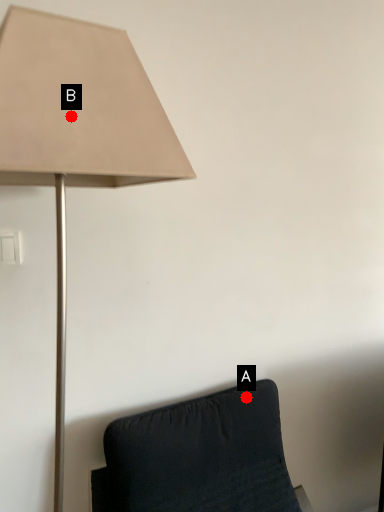
Question: Two points are circled on the image, labeled by A and B beside each circle. Which point is closer to the camera taking this photo?

Choices:
 (A) A is closer
 (B) B is closer

Answer: (B)